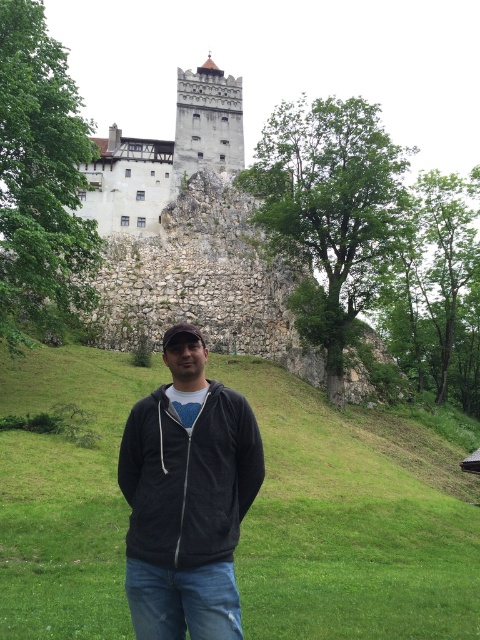
Who is more forward, (129, 392) or (224, 628)?

A: Point (224, 628) is in front.

Does green grass at center have a smaller size compared to dark gray hoodie at center?

Actually, green grass at center might be larger than dark gray hoodie at center.

You are a GUI agent. You are given a task and a screenshot of the screen. Output one action in this format:
    pyautogui.click(x=<x>, y=<y>)
    Task: Click on the green grass at center
    This screenshot has width=480, height=640.
    Given the screenshot: What is the action you would take?
    pyautogui.click(x=350, y=522)

Locate an element on the screen. Image resolution: width=480 pixels, height=640 pixels. green grass at center is located at coordinates (350, 522).

Looking at this image, is dark gray hoodie at center thinner than white stone castle at upper center?

Correct, dark gray hoodie at center's width is less than white stone castle at upper center's.

Between dark gray hoodie at center and white stone castle at upper center, which one is positioned higher?

Positioned higher is white stone castle at upper center.

The height and width of the screenshot is (640, 480). In order to click on dark gray hoodie at center in this screenshot , I will do `click(187, 497)`.

Can you confirm if green grass at center is positioned to the left of white stone castle at upper center?

Incorrect, green grass at center is not on the left side of white stone castle at upper center.

Does point (336, 477) come farther from viewer compared to point (117, 234)?

That is False.

The height and width of the screenshot is (640, 480). Find the location of `green grass at center`. green grass at center is located at coordinates (350, 522).